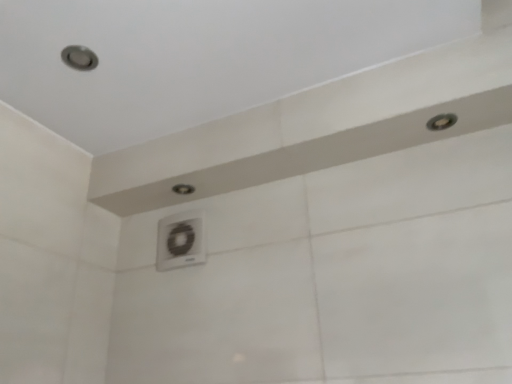
Question: Considering the relative sizes of matte silver shower at upper right, placed as the 2th shower when sorted from back to front, and matte white shower at center, positioned as the 1th shower in left-to-right order, in the image provided, is matte silver shower at upper right, placed as the 2th shower when sorted from back to front, taller than matte white shower at center, positioned as the 1th shower in left-to-right order,?

Choices:
 (A) no
 (B) yes

Answer: (A)

Question: From the image's perspective, is matte silver shower at upper right, the 2th shower when ordered from left to right, on matte white shower at center, the second shower in the front-to-back sequence?

Choices:
 (A) no
 (B) yes

Answer: (B)

Question: Is the depth of matte silver shower at upper right, which is the first shower in right-to-left order, less than that of matte white shower at center, the first shower ordered from the bottom?

Choices:
 (A) yes
 (B) no

Answer: (A)

Question: Is matte silver shower at upper right, placed as the 2th shower when sorted from back to front, at the right side of matte white shower at center, the second shower in the front-to-back sequence?

Choices:
 (A) yes
 (B) no

Answer: (A)

Question: Considering the relative sizes of matte silver shower at upper right, the first shower from the front, and matte white shower at center, positioned as the 1th shower in left-to-right order, in the image provided, is matte silver shower at upper right, the first shower from the front, wider than matte white shower at center, positioned as the 1th shower in left-to-right order,?

Choices:
 (A) no
 (B) yes

Answer: (B)

Question: Is matte silver shower at upper right, which is the first shower in right-to-left order, turned away from matte white shower at center, the second shower in the front-to-back sequence?

Choices:
 (A) no
 (B) yes

Answer: (A)

Question: Does matte white shower at center, which is the first shower from back to front, have a lesser height compared to white plastic air conditioner at center?

Choices:
 (A) yes
 (B) no

Answer: (A)

Question: Is white plastic air conditioner at center inside matte white shower at center, placed as the second shower when sorted from right to left?

Choices:
 (A) no
 (B) yes

Answer: (A)

Question: Considering the relative sizes of matte white shower at center, placed as the second shower when sorted from right to left, and white plastic air conditioner at center in the image provided, is matte white shower at center, placed as the second shower when sorted from right to left, thinner than white plastic air conditioner at center?

Choices:
 (A) no
 (B) yes

Answer: (A)

Question: Considering the relative positions of matte white shower at center, positioned as the 1th shower in left-to-right order, and white plastic air conditioner at center in the image provided, is matte white shower at center, positioned as the 1th shower in left-to-right order, to the right of white plastic air conditioner at center from the viewer's perspective?

Choices:
 (A) yes
 (B) no

Answer: (A)

Question: From a real-world perspective, is matte white shower at center, positioned as the 1th shower in left-to-right order, physically below white plastic air conditioner at center?

Choices:
 (A) no
 (B) yes

Answer: (A)

Question: Is matte white shower at center, placed as the second shower when sorted from right to left, facing away from white plastic air conditioner at center?

Choices:
 (A) yes
 (B) no

Answer: (B)

Question: Can you confirm if white plastic air conditioner at center is bigger than matte white shower at center, placed as the second shower when sorted from right to left?

Choices:
 (A) no
 (B) yes

Answer: (B)